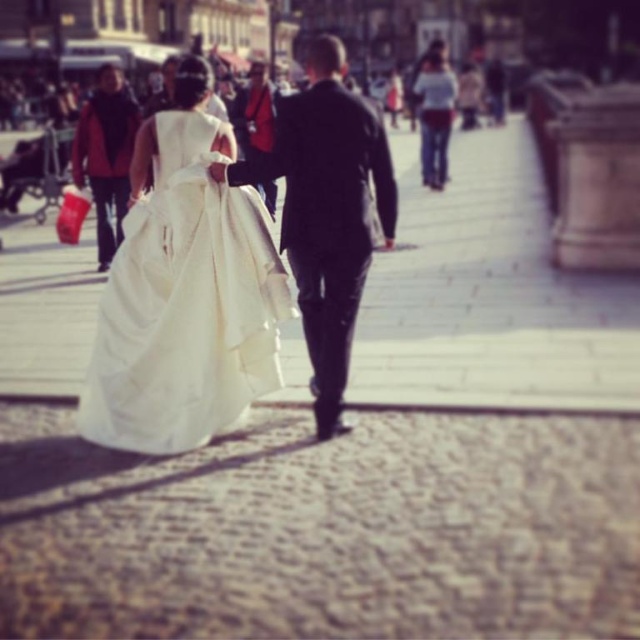
Question: Which point appears closest to the camera in this image?

Choices:
 (A) (330, 45)
 (B) (186, 426)

Answer: (B)

Question: Is ivory satin dress at center wider than shiny black suit at center?

Choices:
 (A) yes
 (B) no

Answer: (A)

Question: Which point is closer to the camera taking this photo?

Choices:
 (A) (259, 348)
 (B) (326, 168)

Answer: (B)

Question: Considering the relative positions of ivory satin dress at center and shiny black suit at center in the image provided, where is ivory satin dress at center located with respect to shiny black suit at center?

Choices:
 (A) above
 (B) below

Answer: (B)

Question: Which object is farther from the camera taking this photo?

Choices:
 (A) shiny black suit at center
 (B) ivory satin dress at center

Answer: (B)

Question: Does ivory satin dress at center have a lesser width compared to shiny black suit at center?

Choices:
 (A) no
 (B) yes

Answer: (A)